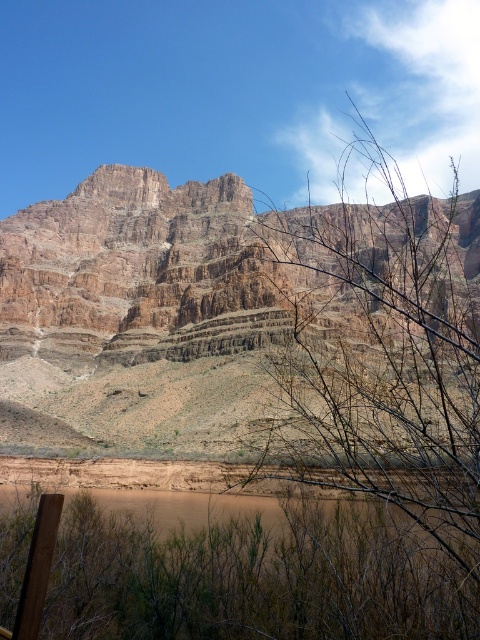
You are an environmental scientist observing the brown rocky mountain at upper center and the brown leafless branches at center. Which object is positioned lower in the scene?

The brown rocky mountain at upper center is positioned below the brown leafless branches at center, so it is lower in the scene.

You are standing at the base of the brown rocky mountain at upper center and want to reach the brown matte lake at lower left. Which direction should you head to get there?

The brown rocky mountain at upper center is closer to you than the brown matte lake at lower left. To reach the lake, you should move away from the mountain towards the lower left direction.

You are standing at the point marked by point [387,392]. What object are you directly facing?

You are directly facing the brown leafless branches at center, as the point [387,392] represents this object.